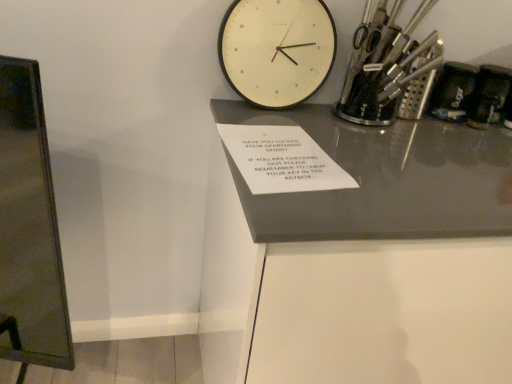
At what (x,y) coordinates should I click in order to perform the action: click on empty space that is in between white matte wall clock at upper center and metallic silver utensils at upper right, the 1th stationery viewed from the left. Please return your answer as a coordinate pair (x, y). Image resolution: width=512 pixels, height=384 pixels. Looking at the image, I should click on (290, 119).